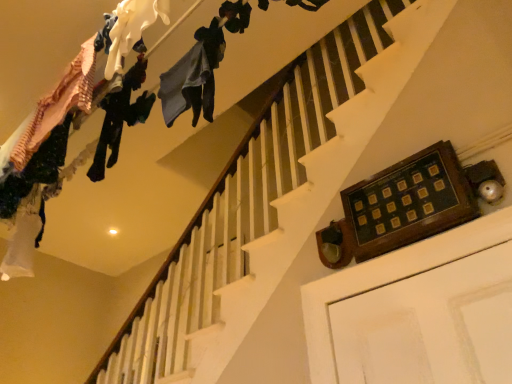
Question: Is the depth of matte white fabric at upper left, positioned as the 2th clothing in right-to-left order, less than that of dark blue fabric at upper center, the 3th clothing viewed from the left?

Choices:
 (A) no
 (B) yes

Answer: (B)

Question: Considering the relative sizes of matte white fabric at upper left, arranged as the second clothing when viewed from the left, and dark blue fabric at upper center, the first clothing when ordered from right to left, in the image provided, is matte white fabric at upper left, arranged as the second clothing when viewed from the left, shorter than dark blue fabric at upper center, the first clothing when ordered from right to left,?

Choices:
 (A) no
 (B) yes

Answer: (B)

Question: Considering the relative positions of matte white fabric at upper left, positioned as the 2th clothing in right-to-left order, and dark blue fabric at upper center, the first clothing when ordered from right to left, in the image provided, is matte white fabric at upper left, positioned as the 2th clothing in right-to-left order, behind dark blue fabric at upper center, the first clothing when ordered from right to left,?

Choices:
 (A) no
 (B) yes

Answer: (A)

Question: Is dark blue fabric at upper center, the first clothing when ordered from right to left, a part of matte white fabric at upper left, arranged as the second clothing when viewed from the left?

Choices:
 (A) no
 (B) yes

Answer: (A)

Question: From the image's perspective, does matte white fabric at upper left, arranged as the second clothing when viewed from the left, appear higher than dark blue fabric at upper center, the 3th clothing viewed from the left?

Choices:
 (A) no
 (B) yes

Answer: (B)

Question: From a real-world perspective, is dark blue fabric at upper center, the first clothing when ordered from right to left, physically located above or below matte white fabric at upper left, arranged as the second clothing when viewed from the left?

Choices:
 (A) above
 (B) below

Answer: (B)

Question: From the image's perspective, relative to matte white fabric at upper left, positioned as the 2th clothing in right-to-left order, is dark blue fabric at upper center, the 3th clothing viewed from the left, above or below?

Choices:
 (A) above
 (B) below

Answer: (B)

Question: Considering the positions of dark blue fabric at upper center, the first clothing when ordered from right to left, and matte white fabric at upper left, arranged as the second clothing when viewed from the left, in the image, is dark blue fabric at upper center, the first clothing when ordered from right to left, taller or shorter than matte white fabric at upper left, arranged as the second clothing when viewed from the left,?

Choices:
 (A) tall
 (B) short

Answer: (A)

Question: Considering the relative positions of dark blue fabric at upper center, the first clothing when ordered from right to left, and matte white fabric at upper left, arranged as the second clothing when viewed from the left, in the image provided, is dark blue fabric at upper center, the first clothing when ordered from right to left, to the left or to the right of matte white fabric at upper left, arranged as the second clothing when viewed from the left,?

Choices:
 (A) right
 (B) left

Answer: (A)

Question: Is dark blue fabric at upper center, the first clothing when ordered from right to left, in front of or behind dark green fabric pants at upper left, which is counted as the third clothing, starting from the right, in the image?

Choices:
 (A) front
 (B) behind

Answer: (A)

Question: Is dark blue fabric at upper center, the 3th clothing viewed from the left, situated inside dark green fabric pants at upper left, which is counted as the third clothing, starting from the right, or outside?

Choices:
 (A) outside
 (B) inside

Answer: (A)

Question: Would you say dark blue fabric at upper center, the 3th clothing viewed from the left, is to the left or to the right of dark green fabric pants at upper left, which is counted as the third clothing, starting from the right, in the picture?

Choices:
 (A) right
 (B) left

Answer: (A)

Question: Considering the positions of dark blue fabric at upper center, the first clothing when ordered from right to left, and dark green fabric pants at upper left, which is the first clothing in left-to-right order, in the image, is dark blue fabric at upper center, the first clothing when ordered from right to left, taller or shorter than dark green fabric pants at upper left, which is the first clothing in left-to-right order,?

Choices:
 (A) tall
 (B) short

Answer: (B)

Question: Would you say dark green fabric pants at upper left, which is the first clothing in left-to-right order, is inside or outside matte white fabric at upper left, arranged as the second clothing when viewed from the left?

Choices:
 (A) inside
 (B) outside

Answer: (B)

Question: From the image's perspective, relative to matte white fabric at upper left, positioned as the 2th clothing in right-to-left order, is dark green fabric pants at upper left, which is the first clothing in left-to-right order, above or below?

Choices:
 (A) below
 (B) above

Answer: (A)